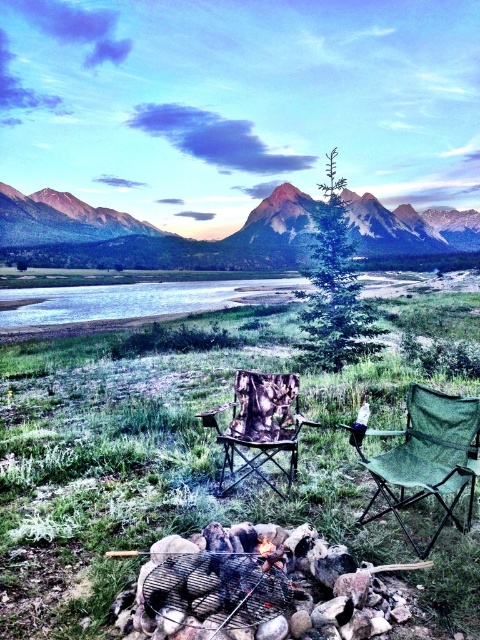
Can you confirm if rugged granite mountain at upper center is wider than green fabric folding chair at center?

Yes.

Which is below, rugged granite mountain at upper center or green fabric folding chair at center?

green fabric folding chair at center is lower down.

In the scene shown: Measure the distance between point (392,227) and camera.

A distance of 89.86 meters exists between point (392,227) and camera.

Identify the location of rugged granite mountain at upper center. The width and height of the screenshot is (480, 640). (190, 243).

In order to click on green fabric folding chair at center in this screenshot , I will do `click(427, 458)`.

Where is `green fabric folding chair at center`? This screenshot has height=640, width=480. green fabric folding chair at center is located at coordinates (427, 458).

At what (x,y) coordinates should I click in order to perform the action: click on green fabric folding chair at center. Please return your answer as a coordinate pair (x, y). The width and height of the screenshot is (480, 640). Looking at the image, I should click on click(427, 458).

Is rugged granite mountain at upper center closer to camera compared to camo fabric chair at center?

That is False.

Is rugged granite mountain at upper center smaller than camo fabric chair at center?

No, rugged granite mountain at upper center is not smaller than camo fabric chair at center.

The height and width of the screenshot is (640, 480). What are the coordinates of `rugged granite mountain at upper center` in the screenshot? It's located at (190, 243).